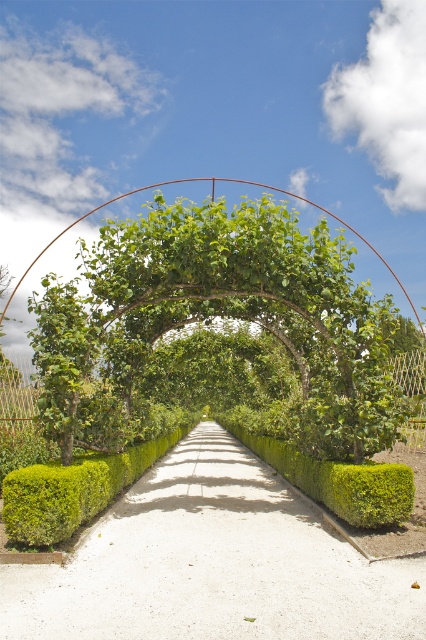
You are standing at the entrance of the garden pathway and want to know which object is taller between the green leafy tree at center and the green leafy hedge at center. Can you tell me?

The green leafy tree at center is taller than the green leafy hedge at center.

You are standing at the entrance of the garden pathway and see the point marked at coordinates (x=221, y=317). What object is located at that point?

The point at coordinates (x=221, y=317) corresponds to the green leafy tree at center.

You are standing at the entrance of the garden pathway and see two points marked in the scene. The first point is at coordinates point (339, 301) and the second is at point (40, 497). Which point is closer to you?

Point (339, 301) is further to the viewer than point (40, 497), so the second point is closer to you.